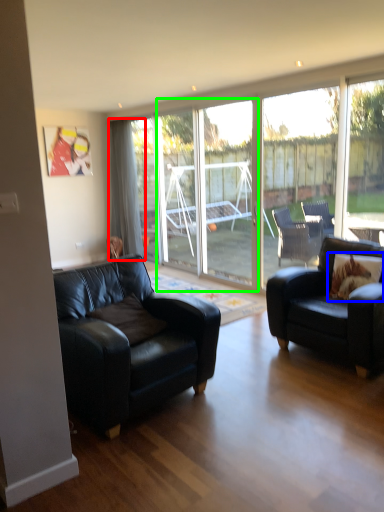
Question: Which is farther away from curtain (highlighted by a red box)? pillow (highlighted by a blue box) or screen door (highlighted by a green box)?

Choices:
 (A) pillow
 (B) screen door

Answer: (A)